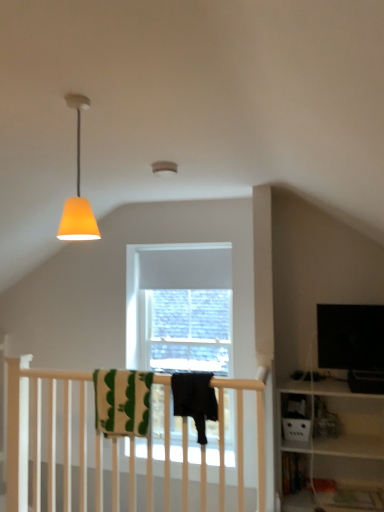
Question: From the image's perspective, is orange matte lampshade at upper left over black cotton towel at center, placed as the 2th beach towel when sorted from left to right?

Choices:
 (A) no
 (B) yes

Answer: (B)

Question: Is the position of orange matte lampshade at upper left more distant than that of black cotton towel at center, placed as the 2th beach towel when sorted from left to right?

Choices:
 (A) no
 (B) yes

Answer: (A)

Question: Is orange matte lampshade at upper left surrounding black cotton towel at center, placed as the 2th beach towel when sorted from left to right?

Choices:
 (A) no
 (B) yes

Answer: (A)

Question: Can you confirm if orange matte lampshade at upper left is bigger than black cotton towel at center, acting as the 1th beach towel starting from the right?

Choices:
 (A) yes
 (B) no

Answer: (B)

Question: From the image's perspective, is orange matte lampshade at upper left under black cotton towel at center, placed as the 2th beach towel when sorted from left to right?

Choices:
 (A) no
 (B) yes

Answer: (A)

Question: Are orange matte lampshade at upper left and black cotton towel at center, placed as the 2th beach towel when sorted from left to right, far apart?

Choices:
 (A) yes
 (B) no

Answer: (A)

Question: Considering the relative sizes of black cotton towel at center, acting as the 1th beach towel starting from the right, and orange matte lampshade at upper left in the image provided, is black cotton towel at center, acting as the 1th beach towel starting from the right, taller than orange matte lampshade at upper left?

Choices:
 (A) no
 (B) yes

Answer: (A)

Question: Could you tell me if black cotton towel at center, placed as the 2th beach towel when sorted from left to right, is turned towards orange matte lampshade at upper left?

Choices:
 (A) yes
 (B) no

Answer: (B)

Question: From a real-world perspective, is black cotton towel at center, acting as the 1th beach towel starting from the right, on top of orange matte lampshade at upper left?

Choices:
 (A) no
 (B) yes

Answer: (A)

Question: Considering the relative sizes of black cotton towel at center, placed as the 2th beach towel when sorted from left to right, and orange matte lampshade at upper left in the image provided, is black cotton towel at center, placed as the 2th beach towel when sorted from left to right, wider than orange matte lampshade at upper left?

Choices:
 (A) no
 (B) yes

Answer: (B)

Question: Is orange matte lampshade at upper left at the back of black cotton towel at center, acting as the 1th beach towel starting from the right?

Choices:
 (A) no
 (B) yes

Answer: (A)

Question: Is black cotton towel at center, placed as the 2th beach towel when sorted from left to right, to the right of orange matte lampshade at upper left from the viewer's perspective?

Choices:
 (A) no
 (B) yes

Answer: (B)

Question: From a real-world perspective, is green striped towel at center, which is counted as the second beach towel, starting from the right, positioned over orange matte lampshade at upper left based on gravity?

Choices:
 (A) no
 (B) yes

Answer: (A)